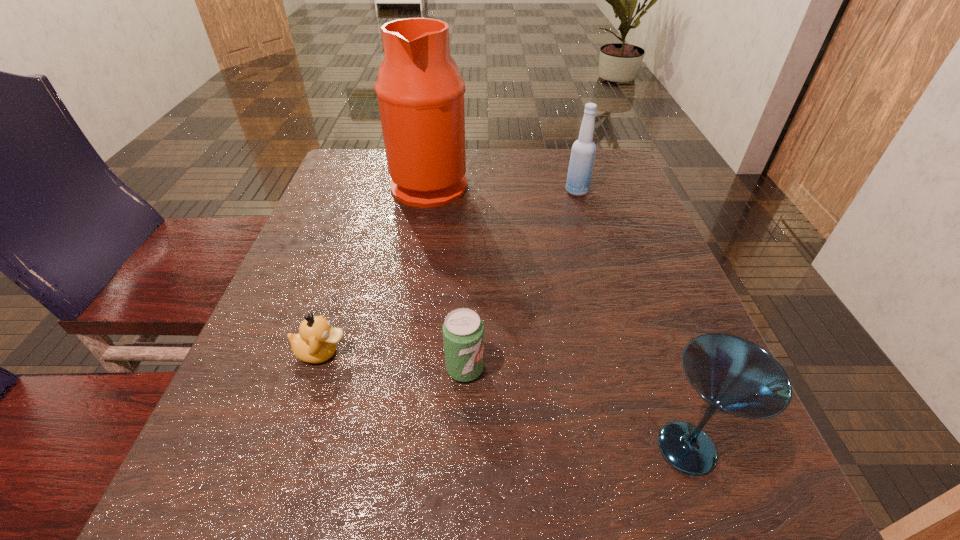
The width and height of the screenshot is (960, 540). I want to click on object at the near right corner, so click(734, 376).

Find the location of a particular element. Image resolution: width=960 pixels, height=540 pixels. vacant space at the far edge of the desktop is located at coordinates (499, 161).

The image size is (960, 540). Find the location of `free spot at the near edge of the desktop`. free spot at the near edge of the desktop is located at coordinates (582, 481).

Image resolution: width=960 pixels, height=540 pixels. I want to click on vacant region at the left edge of the desktop, so click(x=294, y=252).

Where is `vacant point at the right edge`? The image size is (960, 540). vacant point at the right edge is located at coordinates (596, 269).

In the image, there is a desktop. Where is `vacant space at the near left corner`? vacant space at the near left corner is located at coordinates (310, 491).

Find the location of a particular element. free location at the far right corner of the desktop is located at coordinates (598, 165).

At what (x,y) coordinates should I click in order to perform the action: click on unoccupied area between the fourth tallest object and the duckling. Please return your answer as a coordinate pair (x, y). Image resolution: width=960 pixels, height=540 pixels. Looking at the image, I should click on (394, 360).

Find the location of a particular element. vacant area between the soda and the bottle is located at coordinates (521, 280).

Where is `free spot between the martini and the soda`? free spot between the martini and the soda is located at coordinates (576, 408).